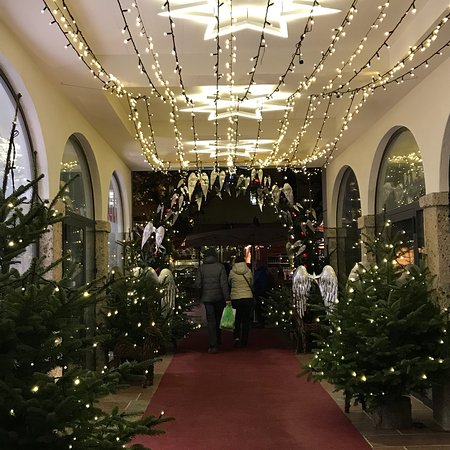
Where is `windows`? windows is located at coordinates (24, 160), (81, 190), (113, 202), (347, 202), (405, 182).